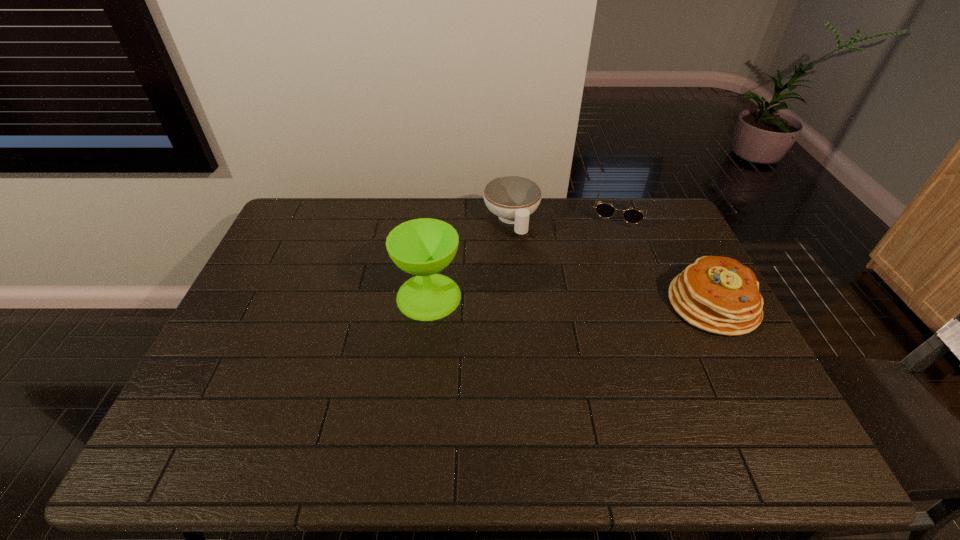
Identify the location of free space between the chinaware and the shortest object. Image resolution: width=960 pixels, height=540 pixels. (565, 217).

In order to click on unoccupied area between the sunglasses and the second shortest object in this screenshot , I will do `click(565, 217)`.

In order to click on free space between the chinaware and the wineglass in this screenshot , I will do `click(470, 258)`.

At what (x,y) coordinates should I click in order to perform the action: click on vacant area that lies between the shortest object and the wineglass. Please return your answer as a coordinate pair (x, y). Looking at the image, I should click on (524, 255).

I want to click on vacant area that lies between the sunglasses and the chinaware, so click(x=565, y=217).

Image resolution: width=960 pixels, height=540 pixels. Identify the location of object that is the closest to the chinaware. (423, 247).

Locate an element on the screen. This screenshot has height=540, width=960. object that is the closest to the pancake is located at coordinates (633, 216).

You are a GUI agent. You are given a task and a screenshot of the screen. Output one action in this format:
    pyautogui.click(x=<x>, y=<y>)
    Task: Click on the free point that satisfies the following two spatial constraints: 1. on the front side of the sunglasses; 2. on the right side of the pancake
    Image resolution: width=960 pixels, height=540 pixels.
    Given the screenshot: What is the action you would take?
    pyautogui.click(x=654, y=305)

Where is `free location that satisfies the following two spatial constraints: 1. on the front side of the shortest object; 2. on the left side of the pancake`? free location that satisfies the following two spatial constraints: 1. on the front side of the shortest object; 2. on the left side of the pancake is located at coordinates (654, 305).

What are the coordinates of `vacant space that satisfies the following two spatial constraints: 1. on the back side of the sunglasses; 2. on the right side of the tallest object` in the screenshot? It's located at (439, 214).